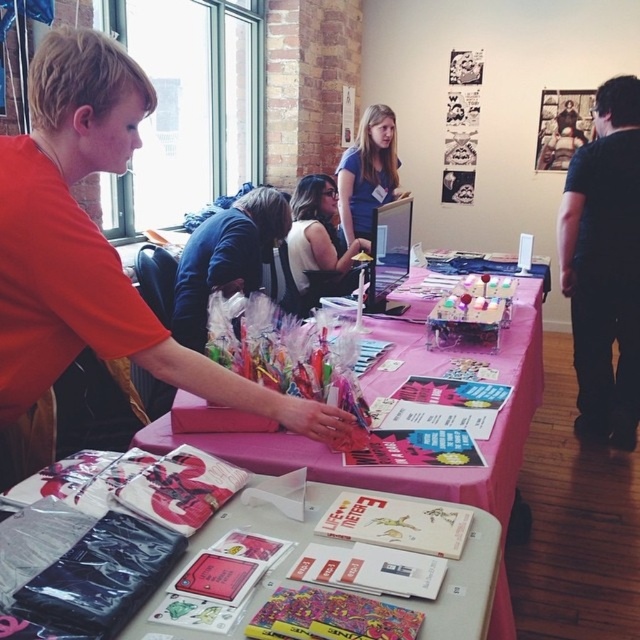
You are organizing an event and need to place a new item on the table. The item is a heavy sculpture that requires a stable surface. Given the pink fabric tablecloth at center and the blue cotton shirt at center, which object should you avoid placing the sculpture on to ensure stability?

You should avoid placing the sculpture on the pink fabric tablecloth at center because the blue cotton shirt at center is positioned over it, making the tablecloth unstable due to being covered by the shirt.

You are organizing a booth and need to hang two shirts on a rack. The matte orange shirt at left and the white fabric shirt at center. Which shirt should you hang first if you want to display the wider one on the left side of the rack?

The matte orange shirt at left might be wider than the white fabric shirt at center, so you should hang the matte orange shirt at left first on the left side of the rack to display the wider one there.